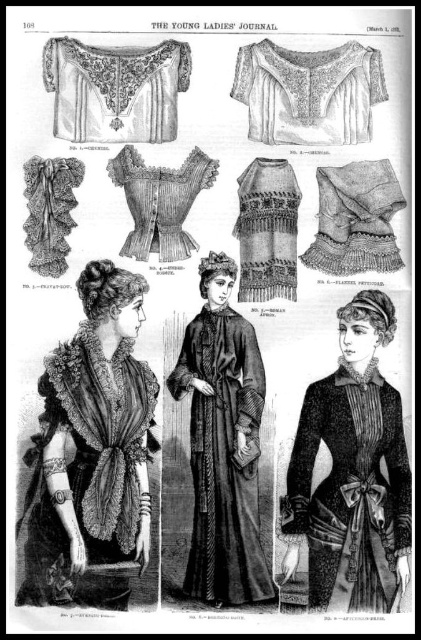
Question: Which of these objects is positioned closest to the velvet-like fabric dress at center?

Choices:
 (A) white lace blouse at upper center
 (B) matte white lace corset at center
 (C) matte white lace blouse at upper left
 (D) matte black dress at center

Answer: (B)

Question: Does velvet-like fabric dress at center appear over velvet-like dark coat at center?

Choices:
 (A) no
 (B) yes

Answer: (A)

Question: Based on their relative distances, which object is nearer to the ruffled lace skirt at lower right?

Choices:
 (A) white lace blouse at upper center
 (B) matte white lace blouse at upper left

Answer: (A)

Question: Which object is closer to the camera taking this photo?

Choices:
 (A) matte white lace blouse at upper left
 (B) ruffled lace skirt at lower right

Answer: (B)

Question: Is matte black dress at center to the right of matte white lace corset at center from the viewer's perspective?

Choices:
 (A) no
 (B) yes

Answer: (B)

Question: Is velvet-like dark coat at center smaller than white lace blouse at upper center?

Choices:
 (A) no
 (B) yes

Answer: (A)